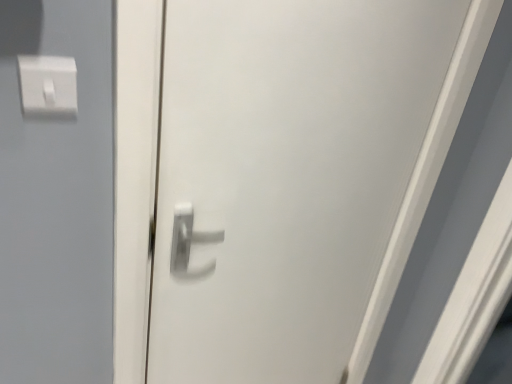
Question: From the image's perspective, is white glossy door handle at center over white plastic light switch at upper left?

Choices:
 (A) no
 (B) yes

Answer: (A)

Question: From a real-world perspective, is white glossy door handle at center positioned over white plastic light switch at upper left based on gravity?

Choices:
 (A) yes
 (B) no

Answer: (B)

Question: Can you confirm if white glossy door handle at center is shorter than white plastic light switch at upper left?

Choices:
 (A) yes
 (B) no

Answer: (B)

Question: Does white glossy door handle at center appear on the left side of white plastic light switch at upper left?

Choices:
 (A) no
 (B) yes

Answer: (A)

Question: From the image's perspective, is white glossy door handle at center under white plastic light switch at upper left?

Choices:
 (A) yes
 (B) no

Answer: (A)

Question: Is white glossy door handle at center to the right of white plastic light switch at upper left from the viewer's perspective?

Choices:
 (A) no
 (B) yes

Answer: (B)

Question: From the image's perspective, is white plastic light switch at upper left over white glossy door handle at center?

Choices:
 (A) no
 (B) yes

Answer: (B)

Question: From the image's perspective, is white plastic light switch at upper left beneath white glossy door handle at center?

Choices:
 (A) yes
 (B) no

Answer: (B)

Question: Considering the relative sizes of white plastic light switch at upper left and white glossy door handle at center in the image provided, is white plastic light switch at upper left smaller than white glossy door handle at center?

Choices:
 (A) no
 (B) yes

Answer: (B)

Question: Can you confirm if white plastic light switch at upper left is shorter than white glossy door handle at center?

Choices:
 (A) no
 (B) yes

Answer: (B)

Question: From a real-world perspective, does white plastic light switch at upper left sit lower than white glossy door handle at center?

Choices:
 (A) yes
 (B) no

Answer: (B)

Question: Is white plastic light switch at upper left facing away from white glossy door handle at center?

Choices:
 (A) no
 (B) yes

Answer: (A)

Question: Do you think white glossy door handle at center is within white plastic light switch at upper left, or outside of it?

Choices:
 (A) outside
 (B) inside

Answer: (A)